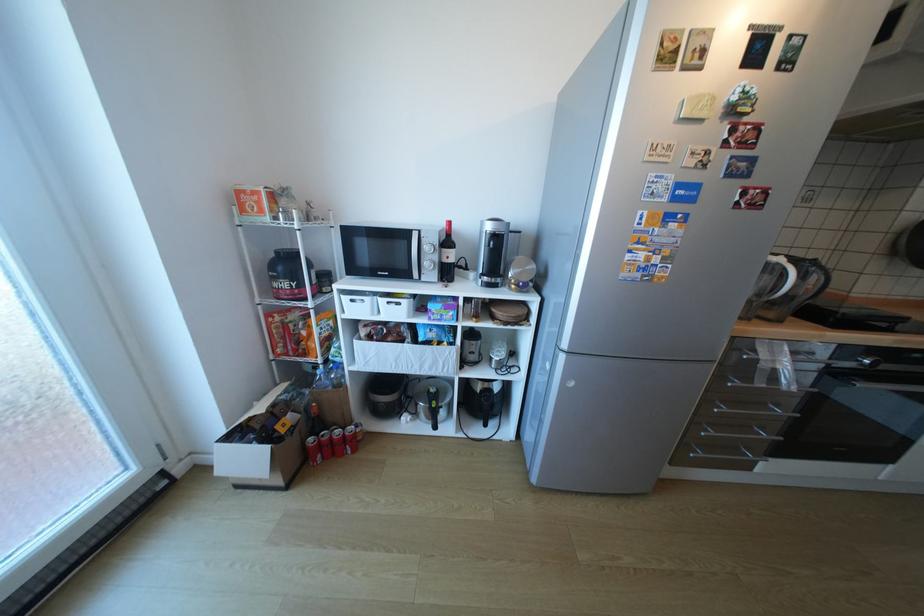
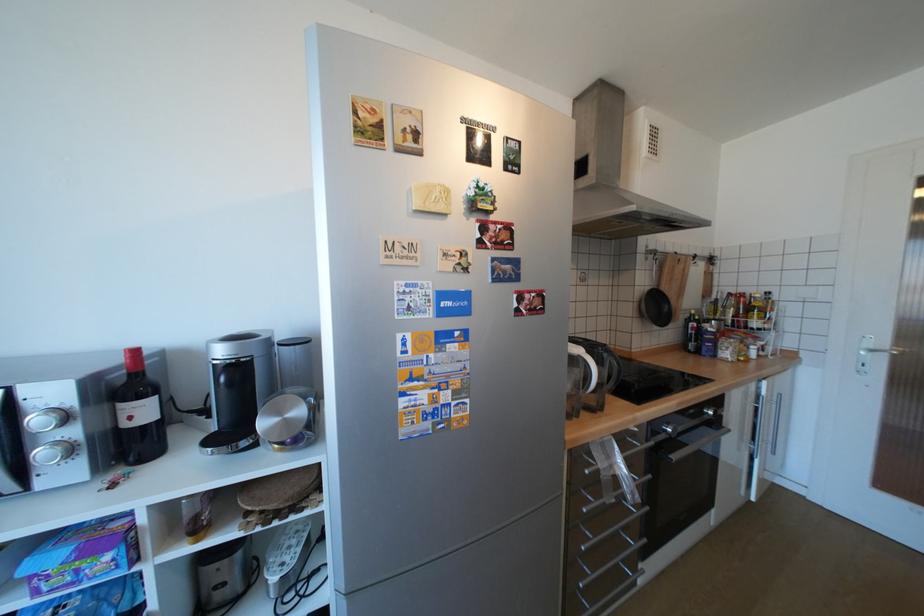
Locate, in the second image, the point that corresponds to (x=523, y=286) in the first image.

(286, 446)